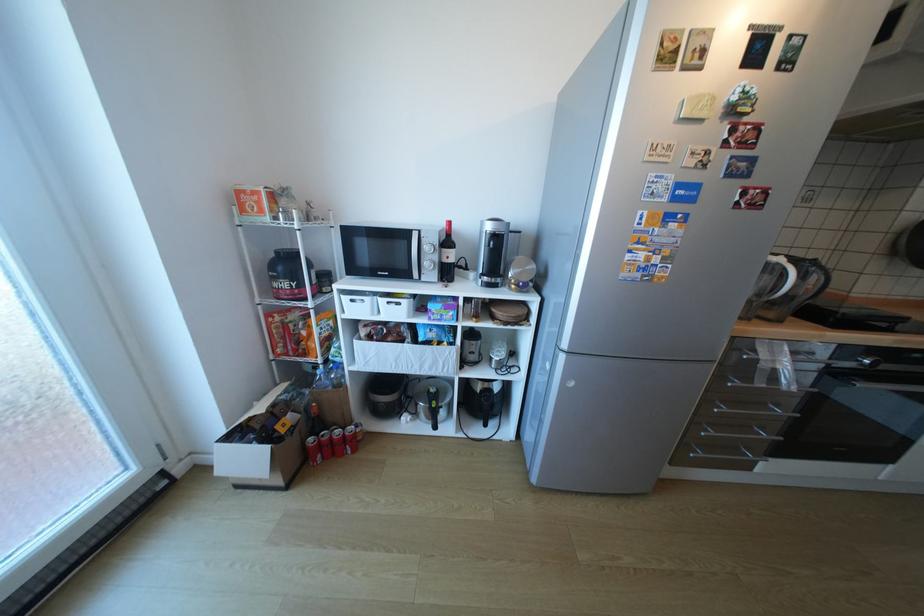
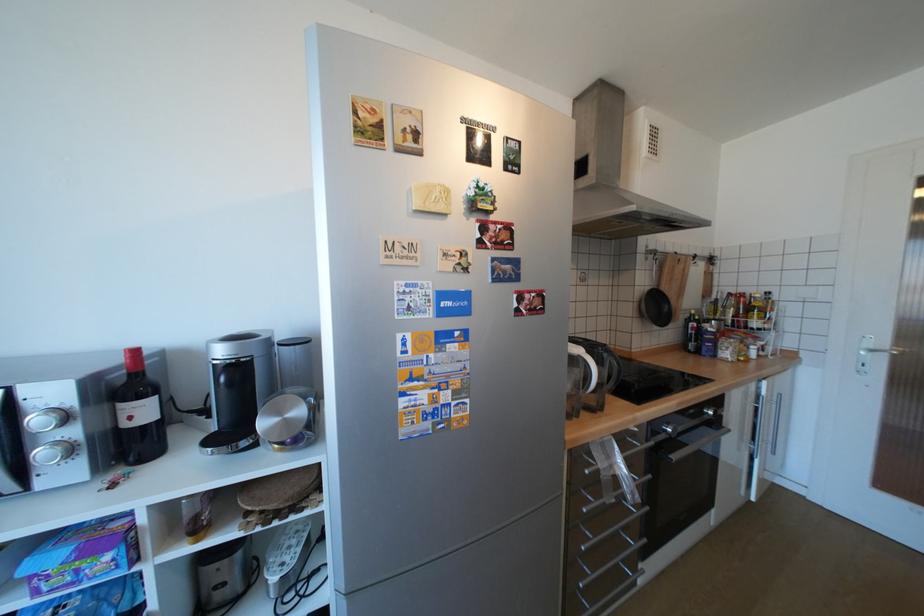
Locate, in the second image, the point that corresponds to (x=523, y=286) in the first image.

(286, 446)